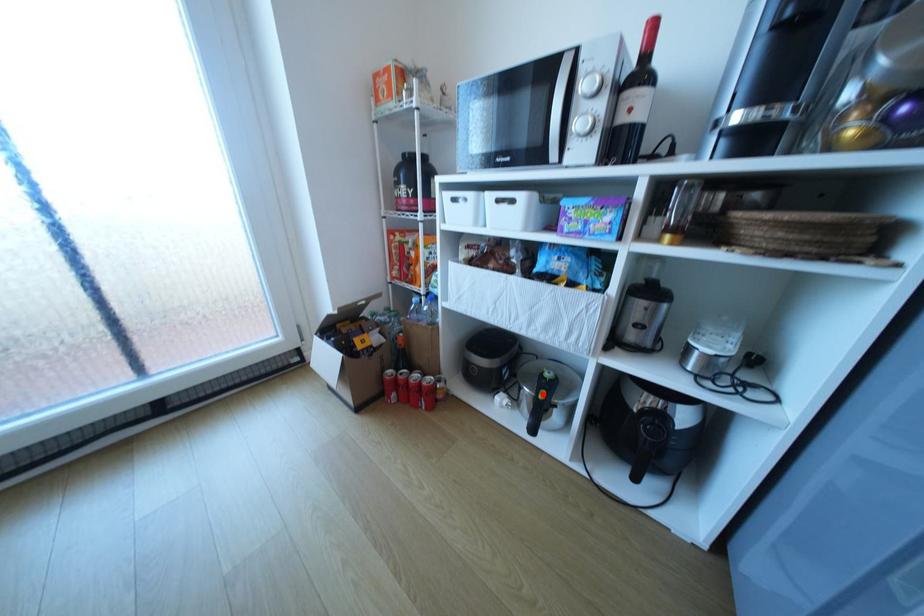
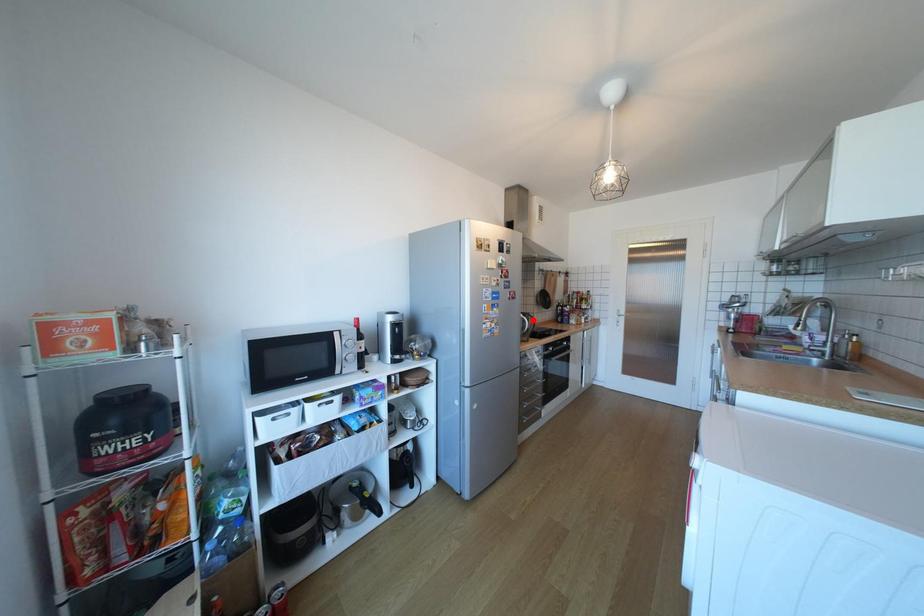
I am providing you with two images of the same scene from different viewpoints. A red point is marked on the first image and another point is marked on the second image. Does the point marked in image1 correspond to the same location as the one in image2?

No